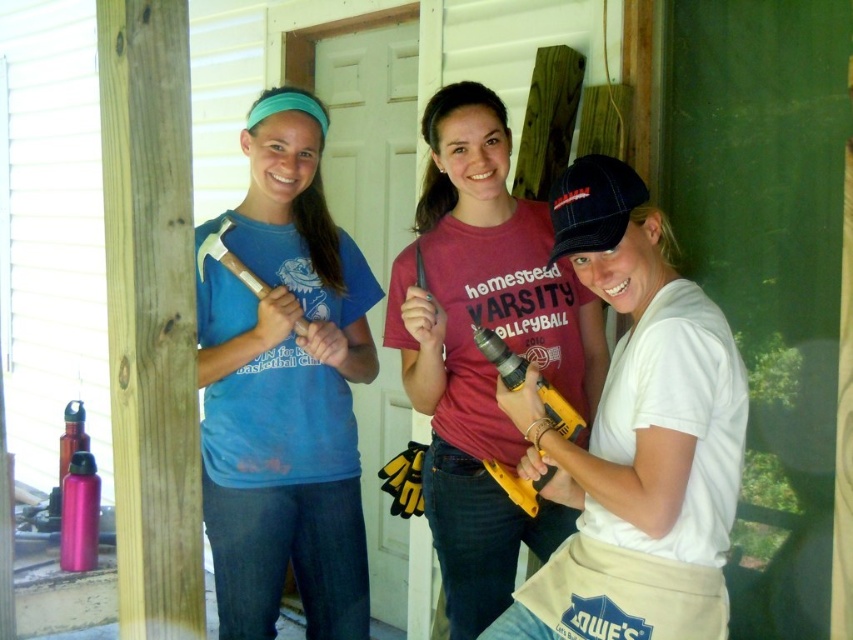
Question: Does matte pink shirt at center appear under metallic hammer at center?

Choices:
 (A) yes
 (B) no

Answer: (A)

Question: Which point appears farthest from the camera in this image?

Choices:
 (A) (587, 173)
 (B) (527, 212)

Answer: (B)

Question: From the image, what is the correct spatial relationship of black fabric baseball cap at center in relation to yellow plastic drill at center?

Choices:
 (A) below
 (B) above

Answer: (B)

Question: Can you confirm if matte blue t-shirt at center is bigger than black fabric baseball cap at center?

Choices:
 (A) yes
 (B) no

Answer: (A)

Question: Based on their relative distances, which object is nearer to the matte pink shirt at center?

Choices:
 (A) metallic hammer at center
 (B) yellow plastic drill at center
 (C) matte blue t-shirt at center

Answer: (B)

Question: Which object is farther from the camera taking this photo?

Choices:
 (A) yellow plastic drill at center
 (B) matte pink shirt at center
 (C) black fabric baseball cap at center
 (D) white matte drill at center

Answer: (B)